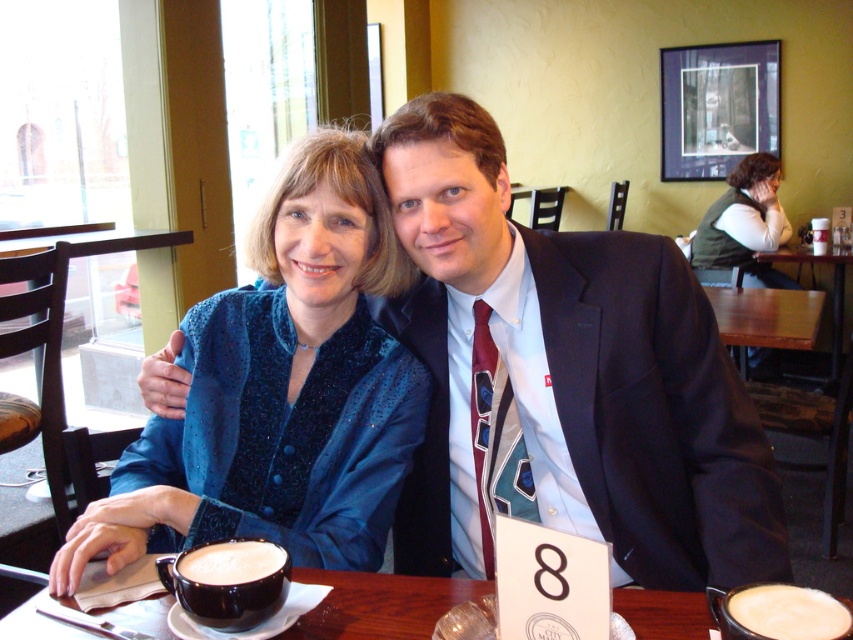
Who is positioned more to the right, matte black suit at center or dark blue textured suit at center?

dark blue textured suit at center

Who is more distant from viewer, (643, 477) or (775, 572)?

The point (643, 477) is more distant.

Identify the location of matte black suit at center. (567, 376).

Who is shorter, matte black suit at center or wooden table at center?

Standing shorter between the two is wooden table at center.

Is matte black suit at center to the right of wooden table at center from the viewer's perspective?

Incorrect, matte black suit at center is not on the right side of wooden table at center.

The image size is (853, 640). In order to click on matte black suit at center in this screenshot , I will do `click(567, 376)`.

Is dark blue textured suit at center smaller than green textured vest at upper right?

Yes.

Is dark blue textured suit at center in front of green textured vest at upper right?

Yes, it is in front of green textured vest at upper right.

Who is more distant from viewer, (660,481) or (711,264)?

Point (711,264)

I want to click on dark blue textured suit at center, so click(654, 412).